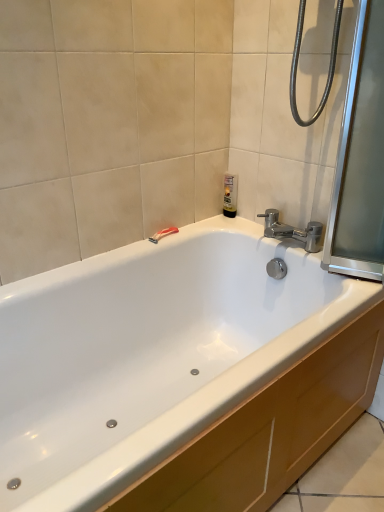
Describe the element at coordinates (230, 195) in the screenshot. I see `translucent plastic bottle at upper center` at that location.

In order to face translucent plastic bottle at upper center, should I rotate leftwards or rightwards?

Turn right approximately 4.809 degrees to face it.

What do you see at coordinates (163, 234) in the screenshot? The width and height of the screenshot is (384, 512). I see `red plastic razor at upper center` at bounding box center [163, 234].

The image size is (384, 512). I want to click on translucent plastic bottle at upper center, so click(230, 195).

Could you tell me if translucent plastic bottle at upper center is turned towards polished chrome faucet at upper right?

Yes.

Is translucent plastic bottle at upper center smaller than polished chrome faucet at upper right?

Yes.

How many degrees apart are the facing directions of translucent plastic bottle at upper center and polished chrome faucet at upper right?

The angular difference between translucent plastic bottle at upper center and polished chrome faucet at upper right is 91.6 degrees.

The image size is (384, 512). What are the coordinates of `toiletry above the polished chrome faucet at upper right (from a real-world perspective)` in the screenshot? It's located at (230, 195).

From the image's perspective, is translucent plastic bottle at upper center above transparent glass screen door at right?

Actually, translucent plastic bottle at upper center appears below transparent glass screen door at right in the image.

Does translucent plastic bottle at upper center appear on the left side of transparent glass screen door at right?

Yes.

Is transparent glass screen door at right located within translucent plastic bottle at upper center?

No, translucent plastic bottle at upper center does not contain transparent glass screen door at right.

Which of these two, translucent plastic bottle at upper center or transparent glass screen door at right, stands taller?

Standing taller between the two is transparent glass screen door at right.

In terms of width, does polished chrome faucet at upper right look wider or thinner when compared to transparent glass screen door at right?

Considering their sizes, polished chrome faucet at upper right looks broader than transparent glass screen door at right.

Identify the location of screen door above the polished chrome faucet at upper right (from the image's perspective). (360, 158).

Is polished chrome faucet at upper right looking in the opposite direction of transparent glass screen door at right?

That's not correct — polished chrome faucet at upper right is not looking away from transparent glass screen door at right.

In the scene shown: Looking at the image, does transparent glass screen door at right seem bigger or smaller compared to polished chrome faucet at upper right?

In the image, transparent glass screen door at right appears to be larger than polished chrome faucet at upper right.

What's the angular difference between transparent glass screen door at right and polished chrome faucet at upper right's facing directions?

The angular difference between transparent glass screen door at right and polished chrome faucet at upper right is 0.627 degrees.

Does transparent glass screen door at right lie behind polished chrome faucet at upper right?

No, transparent glass screen door at right is closer to the viewer.

From the image's perspective, which one is positioned higher, transparent glass screen door at right or polished chrome faucet at upper right?

transparent glass screen door at right is shown above in the image.

From the image's perspective, is transparent glass screen door at right beneath red plastic razor at upper center?

No, from the image's perspective, transparent glass screen door at right is not below red plastic razor at upper center.

Measure the distance between transparent glass screen door at right and red plastic razor at upper center.

The distance of transparent glass screen door at right from red plastic razor at upper center is 70.80 centimeters.

How different are the orientations of transparent glass screen door at right and red plastic razor at upper center in degrees?

The angular difference between transparent glass screen door at right and red plastic razor at upper center is 90.7 degrees.

Which of these two, transparent glass screen door at right or red plastic razor at upper center, is smaller?

red plastic razor at upper center.

Where is `toiletry above the polished chrome faucet at upper right (from a real-world perspective)`? The width and height of the screenshot is (384, 512). toiletry above the polished chrome faucet at upper right (from a real-world perspective) is located at coordinates (230, 195).

Which is in front, point (311, 229) or point (231, 176)?

Point (311, 229)

Is polished chrome faucet at upper right far away from translucent plastic bottle at upper center?

No.

Based on their sizes in the image, would you say red plastic razor at upper center is bigger or smaller than polished chrome faucet at upper right?

Clearly, red plastic razor at upper center is smaller in size than polished chrome faucet at upper right.

From the image's perspective, which is below, red plastic razor at upper center or polished chrome faucet at upper right?

polished chrome faucet at upper right, from the image's perspective.

How much distance is there between red plastic razor at upper center and polished chrome faucet at upper right?

red plastic razor at upper center and polished chrome faucet at upper right are 16.84 inches apart.

Where is `shower above the polished chrome faucet at upper right (from the image's perspective)`? shower above the polished chrome faucet at upper right (from the image's perspective) is located at coordinates (163, 234).

Where is `toiletry that is above the polished chrome faucet at upper right (from the image's perspective)`? The image size is (384, 512). toiletry that is above the polished chrome faucet at upper right (from the image's perspective) is located at coordinates (230, 195).

Where is `toiletry that is on the left side of transparent glass screen door at right`? The height and width of the screenshot is (512, 384). toiletry that is on the left side of transparent glass screen door at right is located at coordinates (230, 195).

Looking at the image, which one is located closer to polished chrome faucet at upper right, transparent glass screen door at right or translucent plastic bottle at upper center?

Based on the image, translucent plastic bottle at upper center appears to be nearer to polished chrome faucet at upper right.

When comparing their distances from translucent plastic bottle at upper center, does transparent glass screen door at right or red plastic razor at upper center seem closer?

Based on the image, red plastic razor at upper center appears to be nearer to translucent plastic bottle at upper center.

Based on their spatial positions, is polished chrome faucet at upper right or red plastic razor at upper center closer to translucent plastic bottle at upper center?

The object closer to translucent plastic bottle at upper center is polished chrome faucet at upper right.

Based on their spatial positions, is transparent glass screen door at right or polished chrome faucet at upper right closer to red plastic razor at upper center?

Among the two, polished chrome faucet at upper right is located nearer to red plastic razor at upper center.

Based on their spatial positions, is polished chrome faucet at upper right or translucent plastic bottle at upper center further from red plastic razor at upper center?

The object further to red plastic razor at upper center is polished chrome faucet at upper right.

Estimate the real-world distances between objects in this image. Which object is further from red plastic razor at upper center, translucent plastic bottle at upper center or polished chrome faucet at upper right?

polished chrome faucet at upper right lies further to red plastic razor at upper center than the other object.

Looking at the image, which one is located closer to polished chrome faucet at upper right, red plastic razor at upper center or transparent glass screen door at right?

transparent glass screen door at right is positioned closer to the anchor polished chrome faucet at upper right.

When comparing their distances from polished chrome faucet at upper right, does red plastic razor at upper center or translucent plastic bottle at upper center seem closer?

translucent plastic bottle at upper center is closer to polished chrome faucet at upper right.

What are the coordinates of `shower between transparent glass screen door at right and translucent plastic bottle at upper center along the z-axis` in the screenshot? It's located at (163, 234).

This screenshot has width=384, height=512. In order to click on tap between transparent glass screen door at right and red plastic razor at upper center from front to back in this screenshot , I will do `click(292, 231)`.

Locate an element on the screen. This screenshot has height=512, width=384. toiletry between red plastic razor at upper center and polished chrome faucet at upper right from left to right is located at coordinates (230, 195).

Image resolution: width=384 pixels, height=512 pixels. In order to click on tap between transparent glass screen door at right and translucent plastic bottle at upper center along the z-axis in this screenshot , I will do `click(292, 231)`.